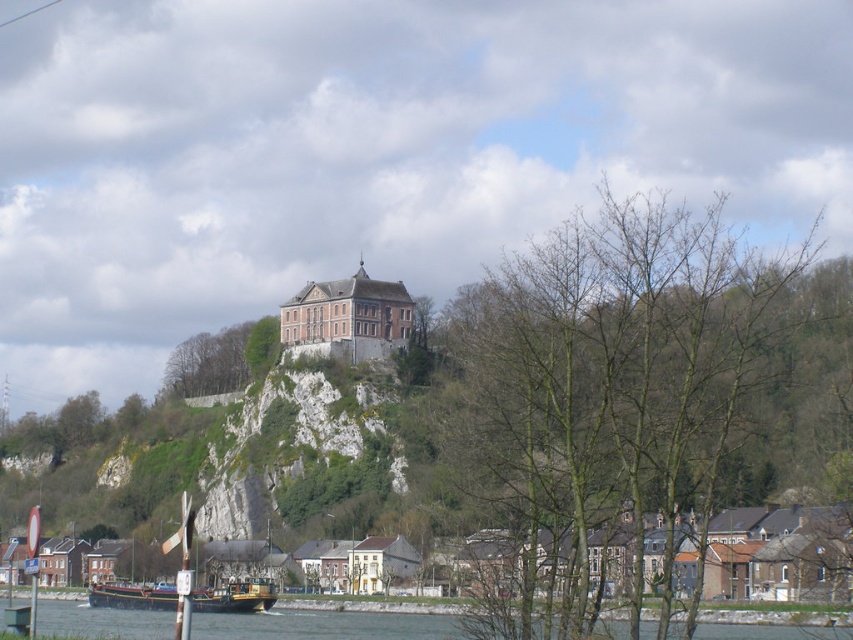
Which is more to the right, blue-green water at lower left or wooden polished barge at lower left?

blue-green water at lower left is more to the right.

Is point (67, 614) more distant than point (123, 598)?

Yes, it is.

You are a GUI agent. You are given a task and a screenshot of the screen. Output one action in this format:
    pyautogui.click(x=<x>, y=<y>)
    Task: Click on the blue-green water at lower left
    This screenshot has width=853, height=640.
    Given the screenshot: What is the action you would take?
    pyautogui.click(x=325, y=625)

Can you confirm if bare branches at center is wider than wooden boat at lower left?

Yes, bare branches at center is wider than wooden boat at lower left.

Can you confirm if bare branches at center is thinner than wooden boat at lower left?

No, bare branches at center is not thinner than wooden boat at lower left.

Find the location of a particular element. The image size is (853, 640). bare branches at center is located at coordinates click(x=608, y=396).

Between blue-green water at lower left and wooden boat at lower left, which one appears on the right side from the viewer's perspective?

blue-green water at lower left is more to the right.

Who is lower down, blue-green water at lower left or wooden boat at lower left?

blue-green water at lower left is below.

Where is `blue-green water at lower left`? The height and width of the screenshot is (640, 853). blue-green water at lower left is located at coordinates (325, 625).

Where is `blue-green water at lower left`? This screenshot has height=640, width=853. blue-green water at lower left is located at coordinates (325, 625).